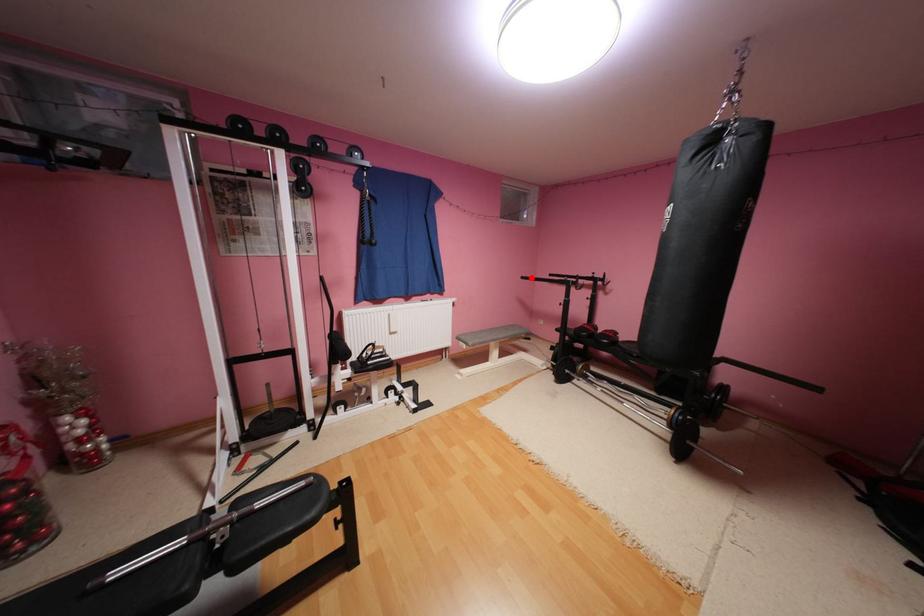
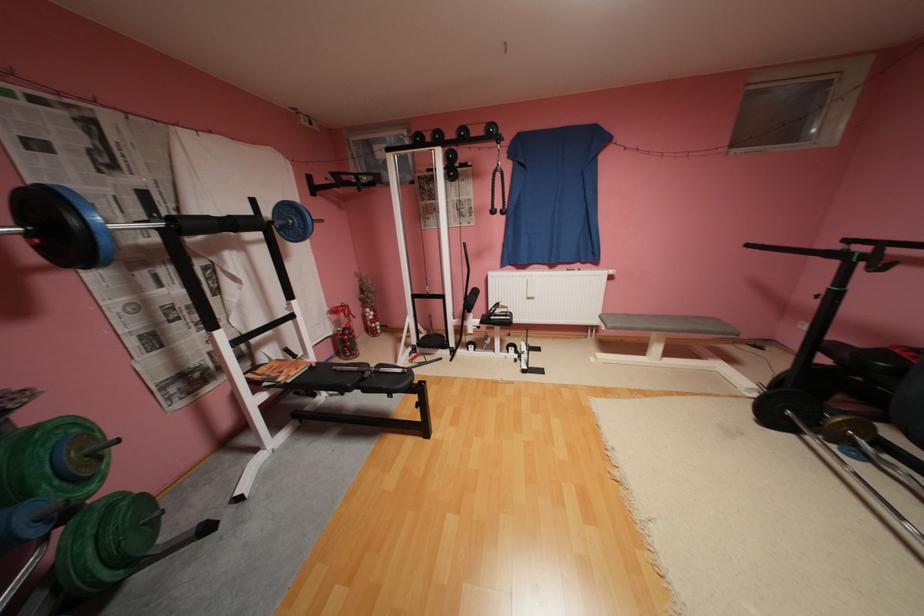
The point at the highlighted location is marked in the first image. Where is the corresponding point in the second image?

(757, 246)